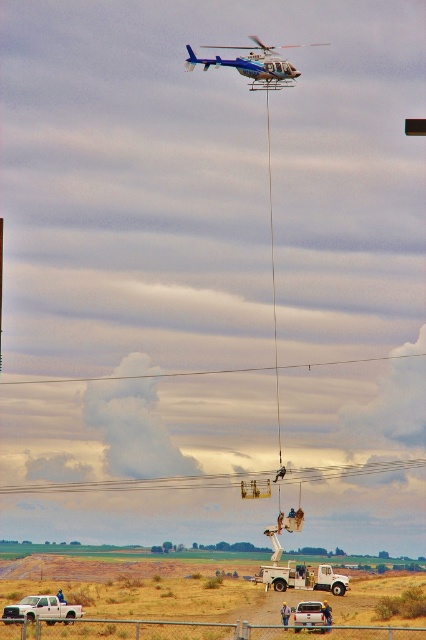
You are a safety inspector assessing the scene. You need to ensure that the blue metallic helicopter at upper center and the white matte truck at lower center are within safe operational distances. Based on the scene description, which object is larger and might require more space for maneuvering?

The blue metallic helicopter at upper center is larger than the white matte truck at lower center, so it would require more space for maneuvering during operations.

You are standing at the point marked as point (42, 609) in the image. What object is located exactly at this point?

The white matte truck at lower left is located exactly at point 0.959, 0.099.

Based on the photo, you are a safety inspector observing the utility operation. You need to ensure that the blue metallic helicopter at upper center and the white matte truck at lower center are aligned properly for safe operation. According to their current positions, which object is positioned to the left of the other?

The blue metallic helicopter at upper center is positioned on the left side of white matte truck at lower center, so the helicopter is to the left of the truck.